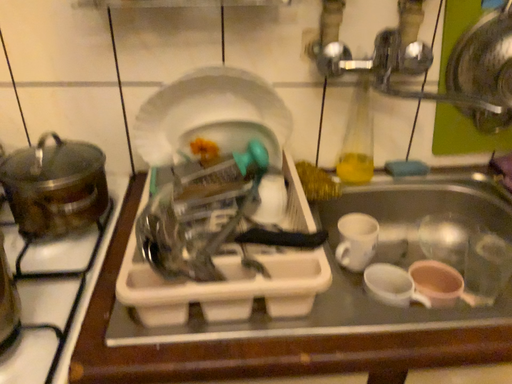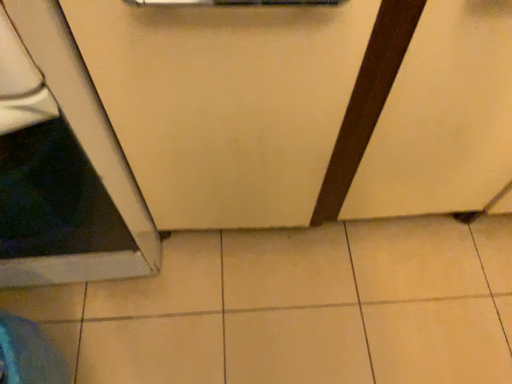
Question: Which way did the camera rotate in the video?

Choices:
 (A) rotated downward
 (B) rotated upward

Answer: (A)